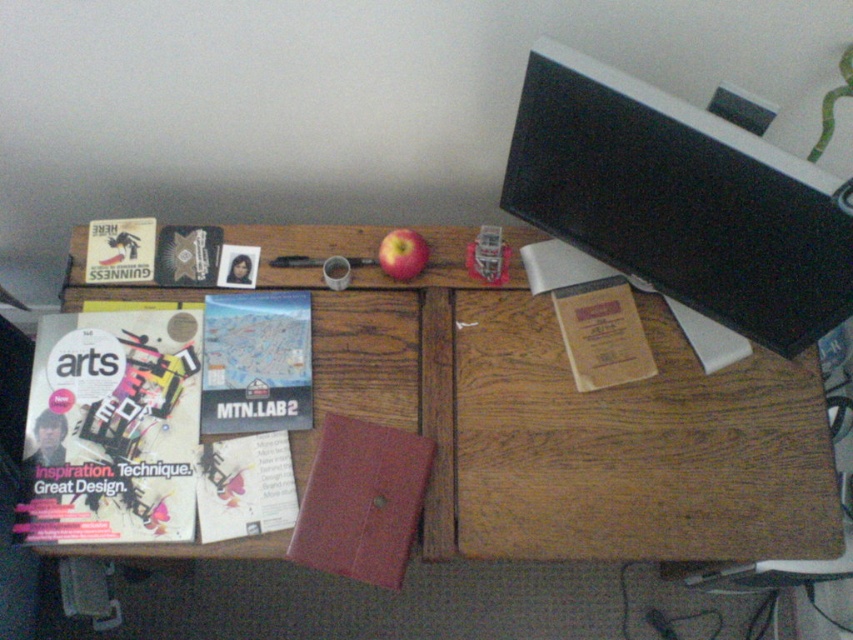
Between point (277, 435) and point (421, 246), which one is positioned behind?

Positioned behind is point (421, 246).

The image size is (853, 640). What do you see at coordinates (245, 486) in the screenshot? I see `matte paper magazine at center` at bounding box center [245, 486].

Does point (271, 467) lie in front of point (408, 246)?

Yes, point (271, 467) is closer to viewer.

Image resolution: width=853 pixels, height=640 pixels. What are the coordinates of `matte paper magazine at center` in the screenshot? It's located at (245, 486).

Can you confirm if black glossy monitor at upper right is taller than matte paper magazine at center?

Yes.

Does point (753, 300) come closer to viewer compared to point (202, 445)?

Yes, it is in front of point (202, 445).

What do you see at coordinates (680, 200) in the screenshot?
I see `black glossy monitor at upper right` at bounding box center [680, 200].

The height and width of the screenshot is (640, 853). Identify the location of black glossy monitor at upper right. (680, 200).

Between point (770, 490) and point (403, 272), which one is positioned in front?

Point (770, 490) is in front.

Find the location of a particular element. wooden desk at center is located at coordinates (570, 424).